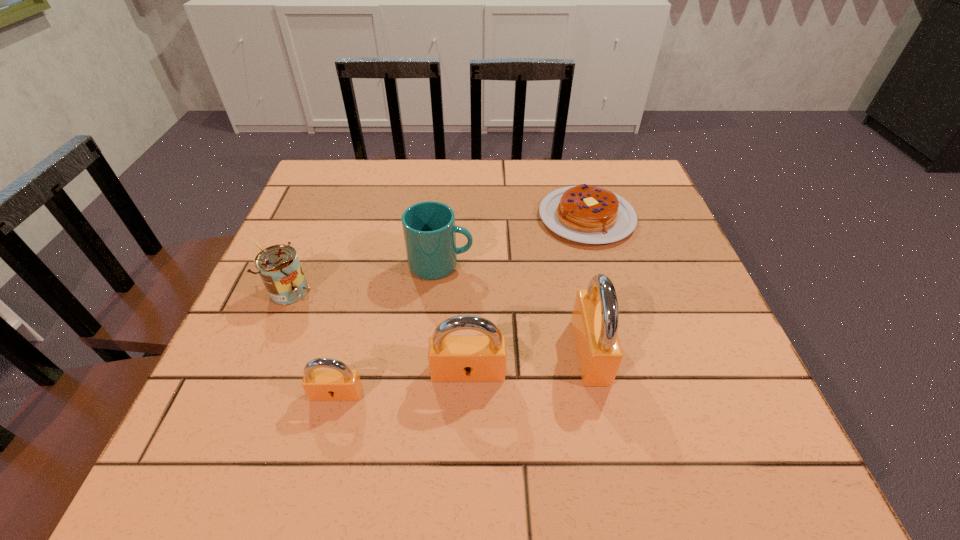
Identify the location of the fifth object from right to left. This screenshot has height=540, width=960. (341, 384).

Where is `the fifth tallest object`? the fifth tallest object is located at coordinates (341, 384).

This screenshot has width=960, height=540. What are the coordinates of `the second shortest padlock` in the screenshot? It's located at (451, 358).

This screenshot has height=540, width=960. In order to click on the rightmost padlock in this screenshot , I will do [595, 318].

Locate an element on the screen. pancake is located at coordinates (583, 213).

You are a GUI agent. You are given a task and a screenshot of the screen. Output one action in this format:
    pyautogui.click(x=<x>, y=<y>)
    Task: Click on the shortest object
    Image resolution: width=960 pixels, height=540 pixels.
    Given the screenshot: What is the action you would take?
    pyautogui.click(x=583, y=213)

I want to click on the leftmost object, so click(279, 267).

Identify the location of cup. (429, 228).

The image size is (960, 540). I want to click on vacant space located to unlock the rightmost padlock from the front, so click(x=702, y=352).

The height and width of the screenshot is (540, 960). In order to click on free point located 0.060m on the back of the pancake in this screenshot , I will do `click(576, 178)`.